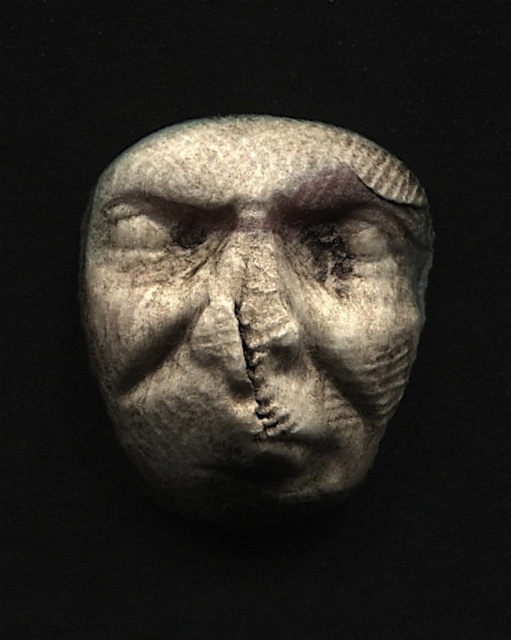
You are standing in a museum and want to take a photo of the gray stone face at center. The museum requires visitors to stay at least 5 feet away from all artifacts. Are you currently within the required distance?

The gray stone face at center is 4.24 feet away from the viewer, which is less than the required 5 feet. You need to move back to comply with the museum rules.

Looking at the carved stone artifact, which object is taller between the gray stone face at center and the gray stone forehead at center?

The gray stone face at center is taller than the gray stone forehead at center.

You are an archaeologist examining the carved stone artifact. You notice two parts of the face labeled as the gray stone face at center and the gray stone forehead at center. Which part has a larger size?

The gray stone face at center is bigger than the gray stone forehead at center.